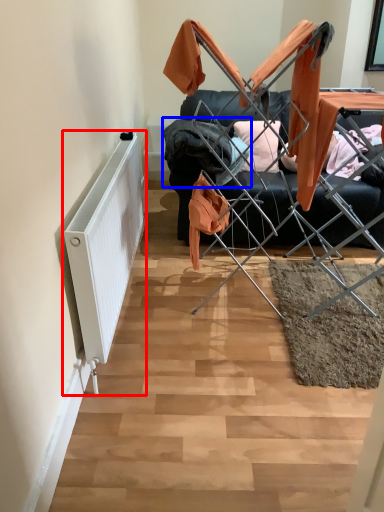
Question: Which of the following is the closest to the observer, radiator (highlighted by a red box) or clothing (highlighted by a blue box)?

Choices:
 (A) radiator
 (B) clothing

Answer: (A)